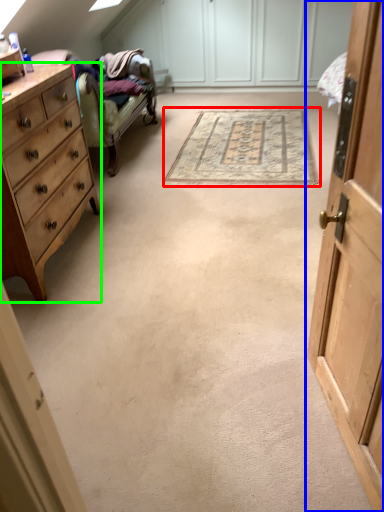
Question: Which object is the farthest from mat (highlighted by a red box)? Choose among these: cabinetry (highlighted by a blue box) or chest of drawers (highlighted by a green box).

Choices:
 (A) cabinetry
 (B) chest of drawers

Answer: (A)